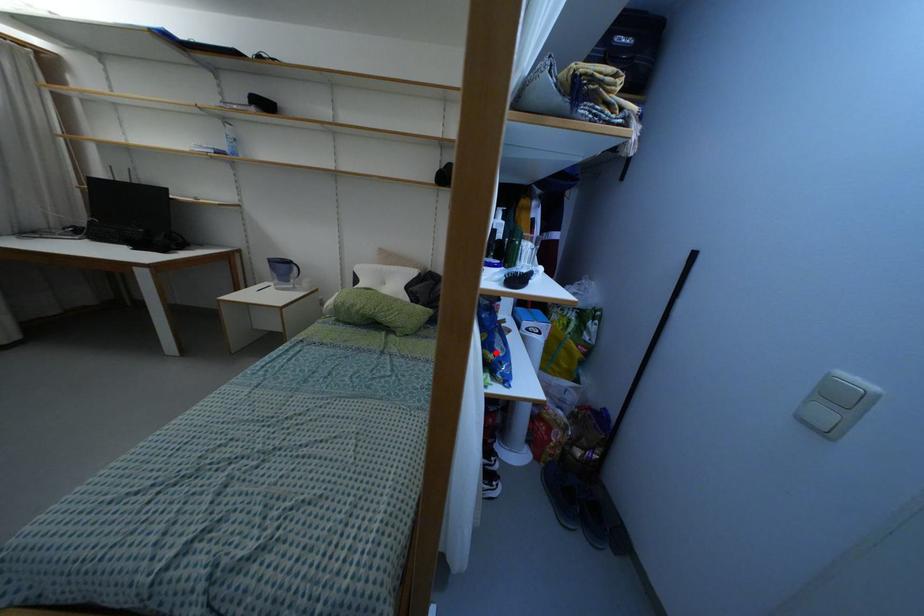
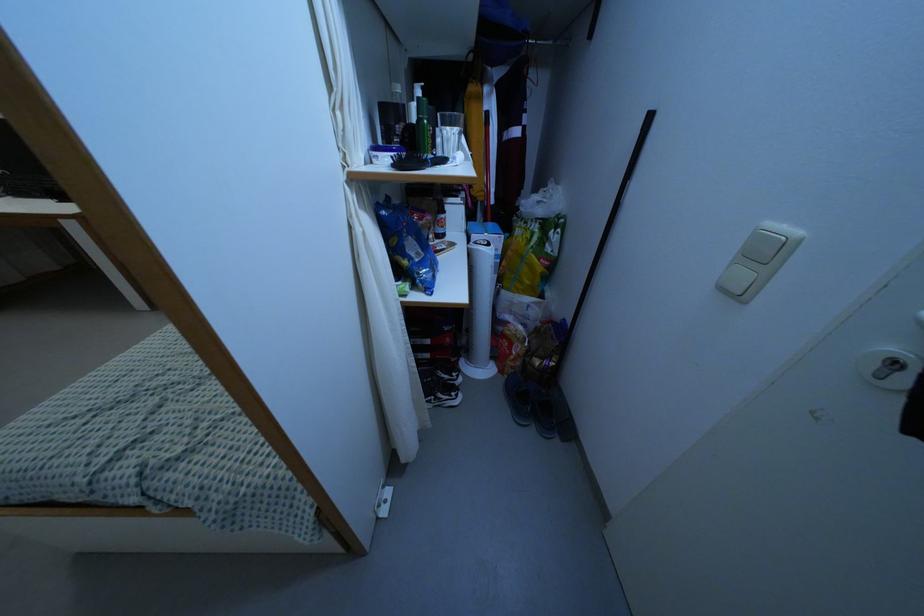
The point at the highlighted location is marked in the first image. Where is the corresponding point in the second image?

(409, 257)